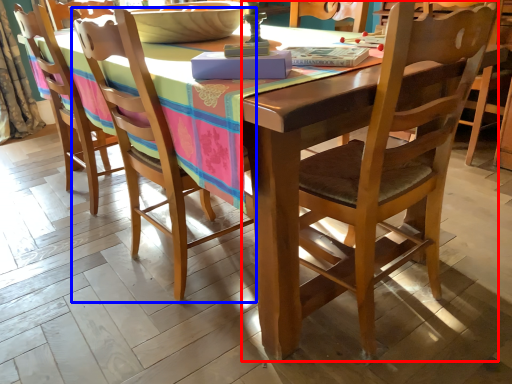
Question: Which object is closer to the camera taking this photo, chair (highlighted by a red box) or chair (highlighted by a blue box)?

Choices:
 (A) chair
 (B) chair

Answer: (A)